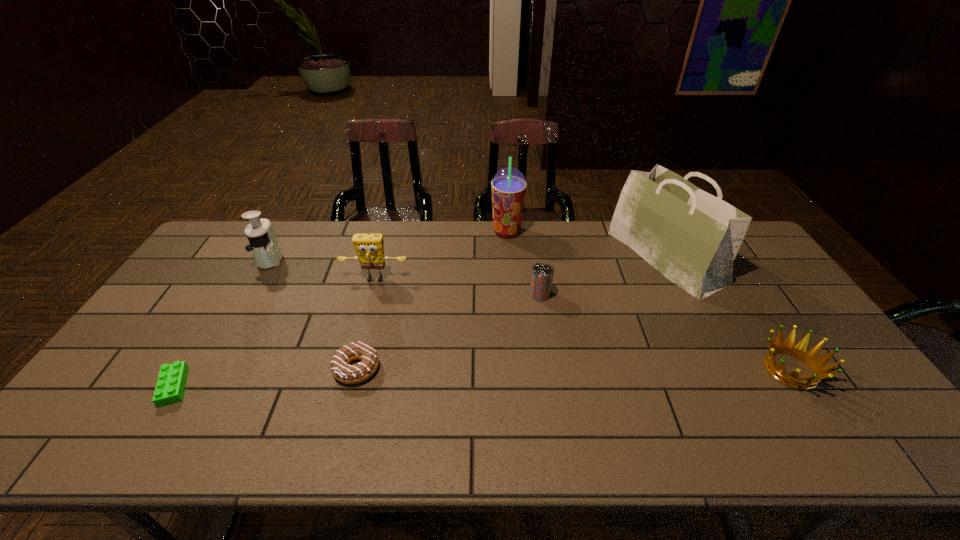
At what (x,y) coordinates should I click in order to perform the action: click on vacant area in the image that satisfies the following two spatial constraints: 1. on the front side of the smoothie; 2. on the left side of the grocery bag. Please return your answer as a coordinate pair (x, y). The image size is (960, 540). Looking at the image, I should click on (509, 256).

Where is `blank area in the image that satisfies the following two spatial constraints: 1. on the back side of the second shortest object; 2. on the left side of the Lego`? blank area in the image that satisfies the following two spatial constraints: 1. on the back side of the second shortest object; 2. on the left side of the Lego is located at coordinates (185, 368).

At what (x,y) coordinates should I click in order to perform the action: click on free spot that satisfies the following two spatial constraints: 1. on the face of the sponge; 2. on the right side of the beer can. Please return your answer as a coordinate pair (x, y). Looking at the image, I should click on (372, 294).

What are the coordinates of `free location that satisfies the following two spatial constraints: 1. on the front side of the sixth tallest object; 2. on the left side of the doughnut` in the screenshot? It's located at (356, 370).